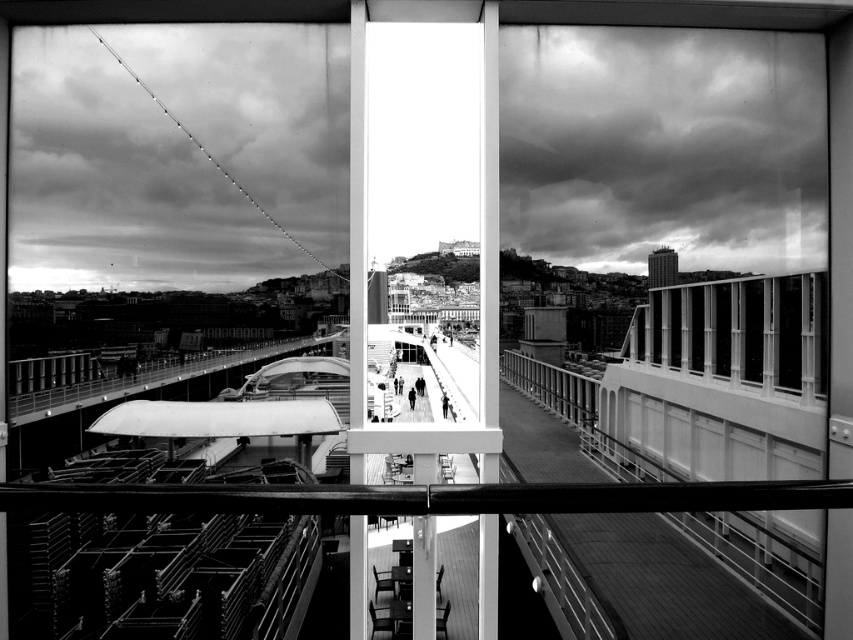
You are standing on the cruise ship deck and want to take a photo of the silhouette figure at center without the metallic glass windows at right appearing in the frame. Is it possible to do so by moving to your left?

The metallic glass windows at right is positioned on the right side of the silhouette figure at center. Moving to your left would place the windows further to your right, potentially allowing you to frame the silhouette figure at center without the windows in the shot if there is enough space.